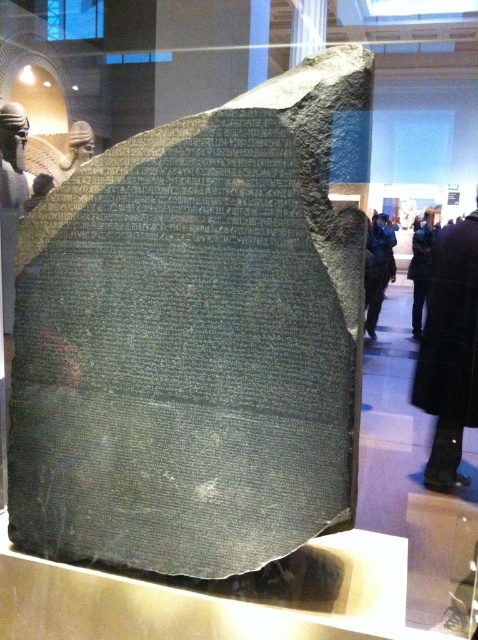
Does black wool coat at lower right have a larger size compared to dark blue coat at center?

Correct, black wool coat at lower right is larger in size than dark blue coat at center.

Who is lower down, black wool coat at lower right or dark blue coat at center?

black wool coat at lower right

Which is in front, point (468, 401) or point (372, 246)?

Point (468, 401) is in front.

This screenshot has height=640, width=478. In order to click on black wool coat at lower right in this screenshot , I will do `click(449, 352)`.

Does dark blue coat at center come behind black leather coat at lower right?

That is False.

Find the location of a particular element. Image resolution: width=478 pixels, height=640 pixels. dark blue coat at center is located at coordinates (379, 269).

The height and width of the screenshot is (640, 478). I want to click on dark blue coat at center, so click(x=379, y=269).

Between green stone stele at center and dark blue coat at center, which one appears on the left side from the viewer's perspective?

green stone stele at center

Which of these two, green stone stele at center or dark blue coat at center, stands taller?

green stone stele at center is taller.

The width and height of the screenshot is (478, 640). I want to click on green stone stele at center, so click(x=198, y=342).

Image resolution: width=478 pixels, height=640 pixels. Find the location of `green stone stele at center`. green stone stele at center is located at coordinates (198, 342).